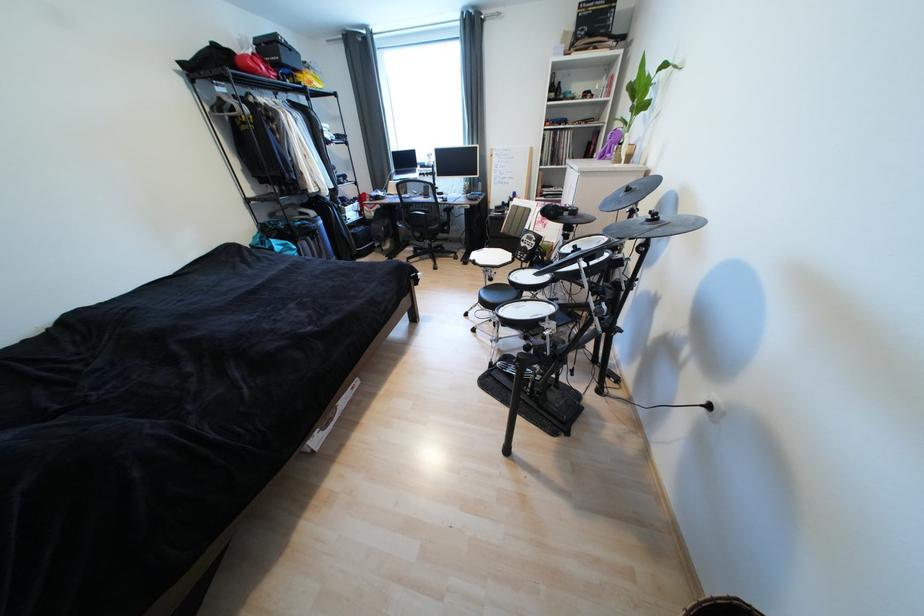
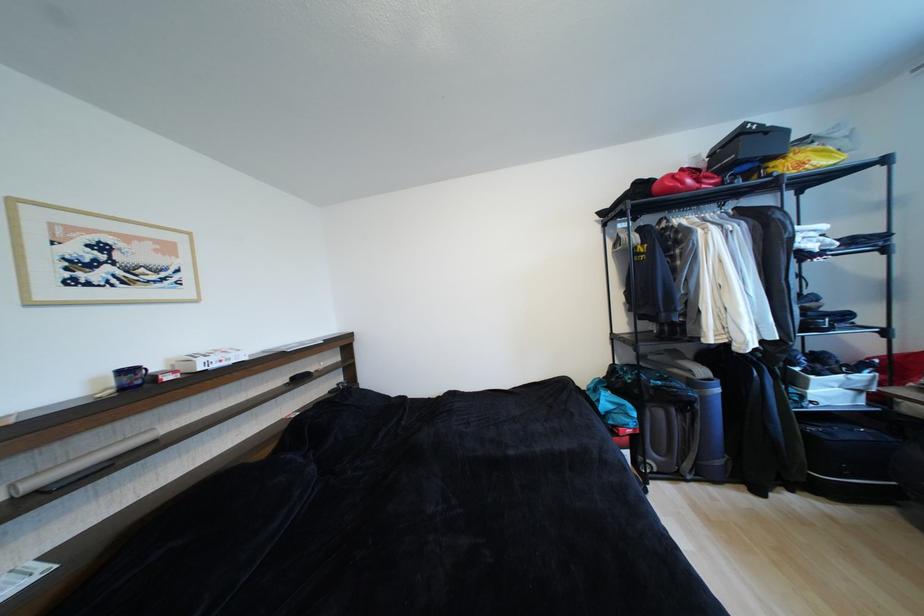
In the second image, find the point that corresponds to (305,77) in the first image.

(780, 166)